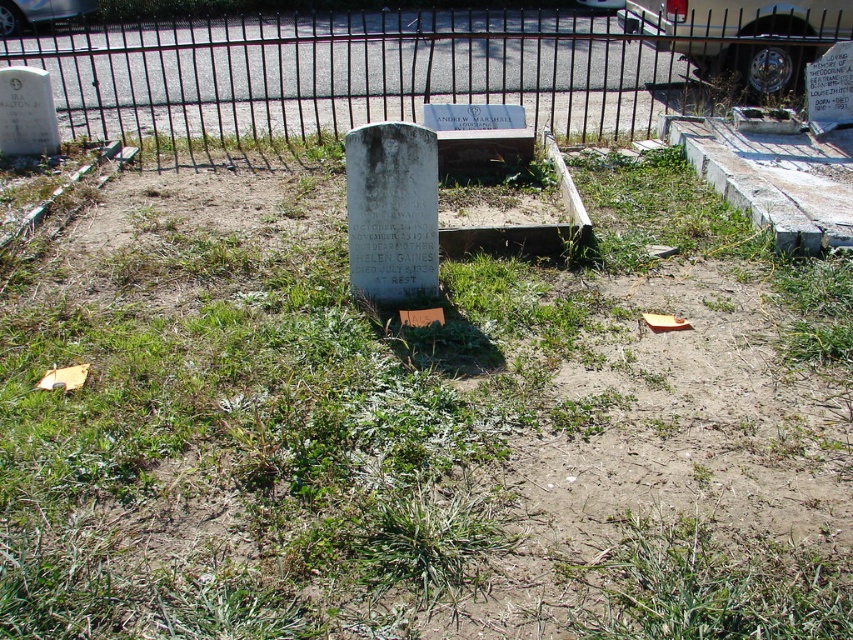
Based on the photo, you are standing at the center of the cemetery looking towards the parking lot. There is a point marked at coordinates [412,68]. Which object does this point correspond to?

The point at coordinates [412,68] corresponds to the black metal fence at upper center.

You are a maintenance worker tasked with painting the black metal fence at upper center and the white marble gravestone at center. If you have enough paint for one of them, which object would you choose to paint based on their size?

The black metal fence at upper center has a greater width than the white marble gravestone at center, so you should choose to paint the black metal fence at upper center since it requires more paint due to its larger size.